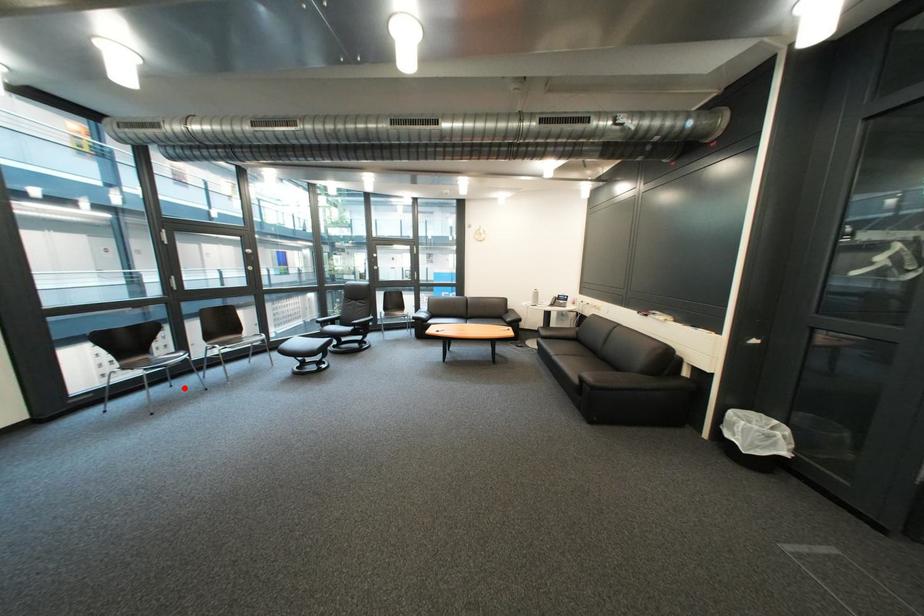
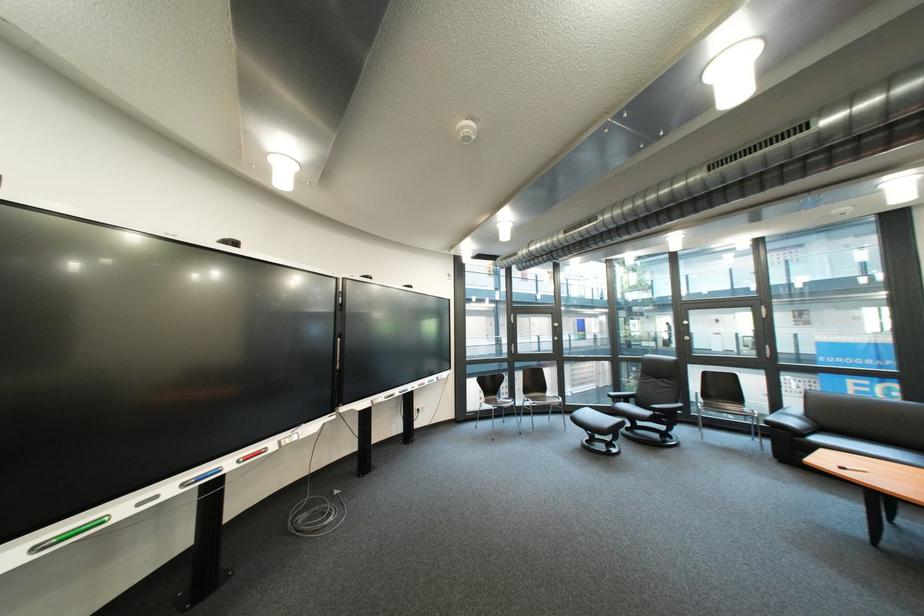
Question: I am providing you with two images of the same scene from different viewpoints. Given a red point in image1, look at the same physical point in image2. Is it:

Choices:
 (A) Closer to the viewpoint
 (B) Farther from the viewpoint

Answer: (B)